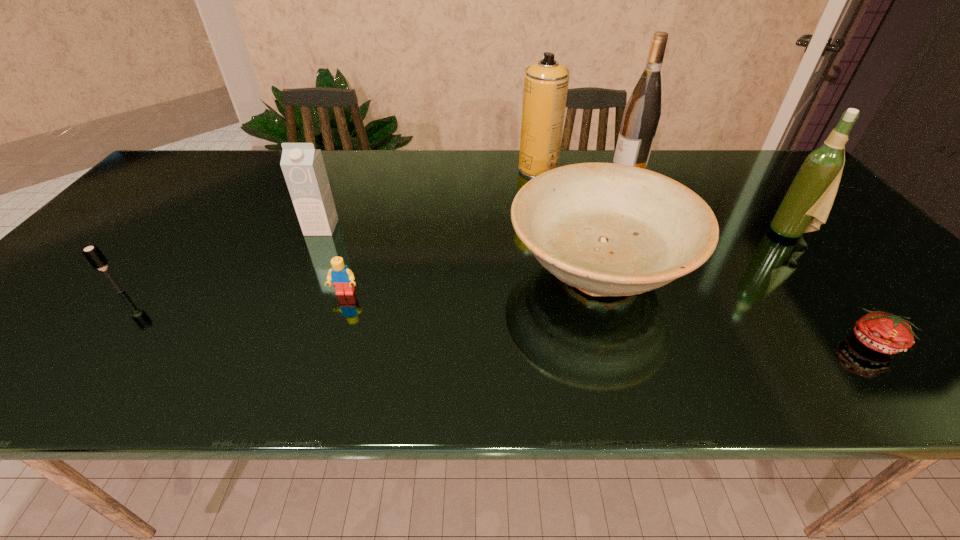
Find the location of a particular element. Image resolution: width=960 pixels, height=540 pixels. the farther wine bottle is located at coordinates (641, 116).

This screenshot has height=540, width=960. I want to click on the taller wine bottle, so click(x=641, y=116).

The image size is (960, 540). Find the location of `aerosol can`. aerosol can is located at coordinates (546, 82).

Where is `the nearer wine bottle`? The width and height of the screenshot is (960, 540). the nearer wine bottle is located at coordinates (806, 205).

Where is `the shorter wine bottle`? the shorter wine bottle is located at coordinates (806, 205).

Find the location of `the fifth shortest object`. the fifth shortest object is located at coordinates (303, 167).

Where is `the seventh object from right to left`? The width and height of the screenshot is (960, 540). the seventh object from right to left is located at coordinates (303, 167).

Find the location of a particular element. This screenshot has height=540, width=960. dish is located at coordinates (608, 229).

Find the location of `the third shortest object`. the third shortest object is located at coordinates point(93,254).

Find the location of `hairbrush`. hairbrush is located at coordinates (93, 254).